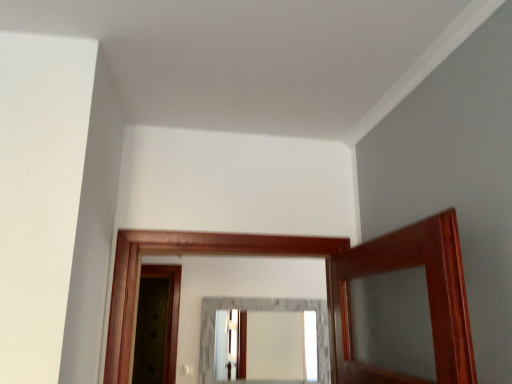
Where is `marble frame mirror at center`? marble frame mirror at center is located at coordinates (260, 310).

What do you see at coordinates (260, 310) in the screenshot? Image resolution: width=512 pixels, height=384 pixels. I see `marble frame mirror at center` at bounding box center [260, 310].

Identify the location of marble frame mirror at center. Image resolution: width=512 pixels, height=384 pixels. (x=260, y=310).